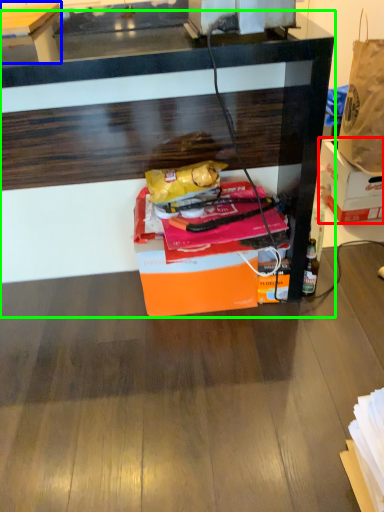
Question: Which is farther away from box (highlighted by a red box)? table (highlighted by a blue box) or desk (highlighted by a green box)?

Choices:
 (A) table
 (B) desk

Answer: (A)